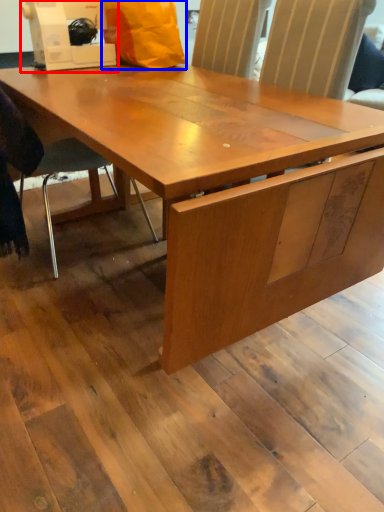
Question: Which of the following is the closest to the observer, sewing machine (highlighted by a red box) or paper bag (highlighted by a blue box)?

Choices:
 (A) sewing machine
 (B) paper bag

Answer: (A)